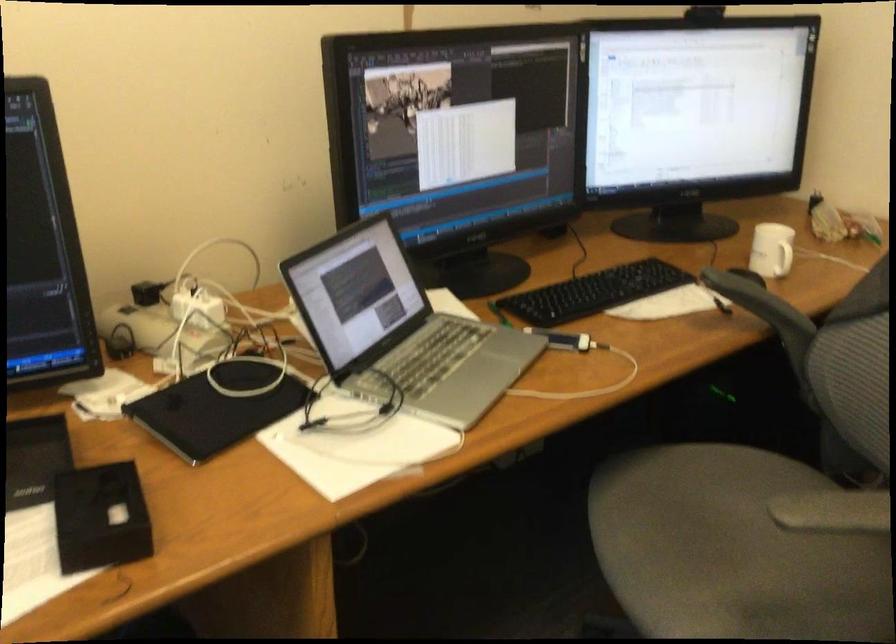
Locate an element on the screen. The image size is (896, 644). black computer keyboard is located at coordinates (593, 292).